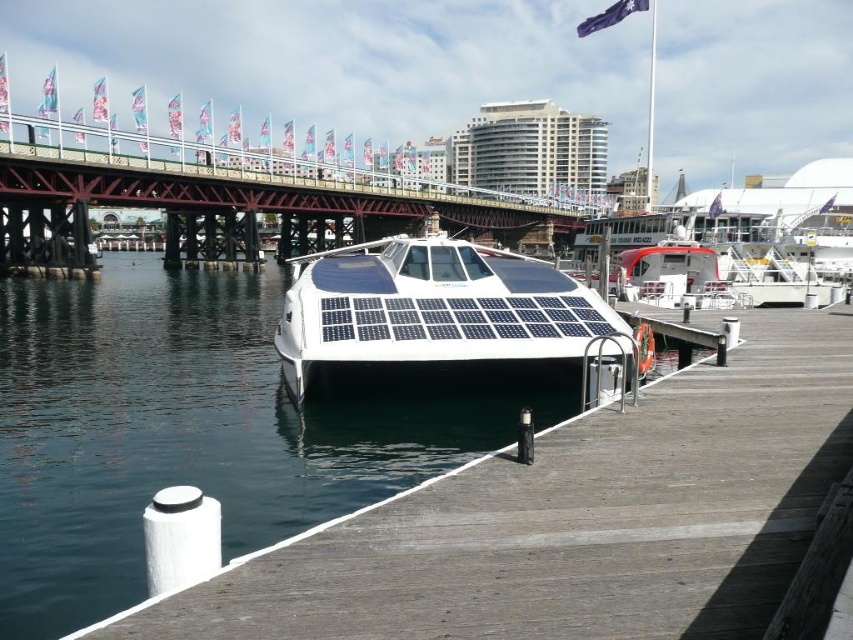
Does white glossy solar panel boat at center appear under white glossy boat at right?

Correct, white glossy solar panel boat at center is located below white glossy boat at right.

Does white glossy solar panel boat at center come behind white glossy boat at right?

No, it is in front of white glossy boat at right.

Describe the element at coordinates (431, 308) in the screenshot. I see `white glossy solar panel boat at center` at that location.

The image size is (853, 640). I want to click on white glossy solar panel boat at center, so click(x=431, y=308).

Between transparent glass water at center and metallic bridge at upper center, which one is positioned higher?

metallic bridge at upper center is above.

Is point (256, 433) farther from viewer compared to point (138, 204)?

No, (256, 433) is in front of (138, 204).

Is point (44, 488) closer to camera compared to point (59, 257)?

Yes, it is in front of point (59, 257).

The height and width of the screenshot is (640, 853). Identify the location of transparent glass water at center. (196, 428).

Between transparent glass water at center and white glossy solar panel boat at center, which one is positioned lower?

Positioned lower is transparent glass water at center.

Is transparent glass water at center above white glossy solar panel boat at center?

No.

Locate an element on the screen. The width and height of the screenshot is (853, 640). transparent glass water at center is located at coordinates (196, 428).